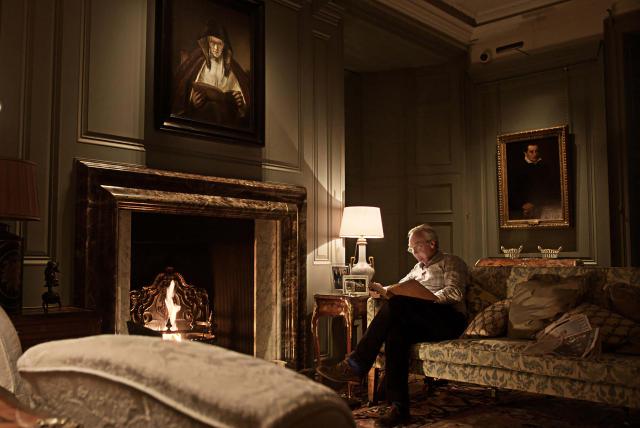
The width and height of the screenshot is (640, 428). Identify the location of sofa. (500, 353), (368, 310), (506, 276).